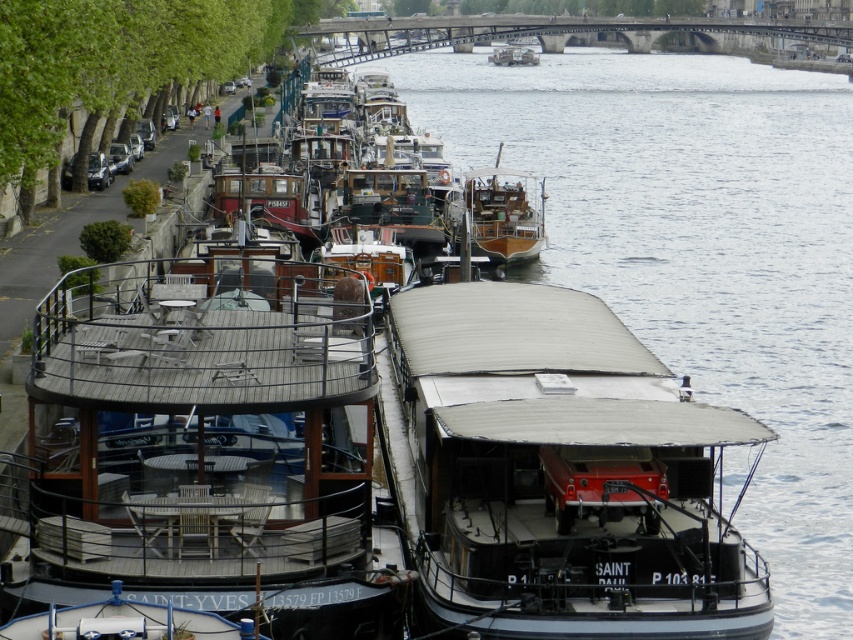
The width and height of the screenshot is (853, 640). I want to click on smooth gray water at center, so click(x=699, y=252).

Where is `smooth gray water at center`? The height and width of the screenshot is (640, 853). smooth gray water at center is located at coordinates (699, 252).

Between smooth gray water at center and black matte boat at center, which one has more height?

smooth gray water at center

Between point (819, 109) and point (463, 460), which one is positioned behind?

The point (819, 109) is behind.

Identify the location of smooth gray water at center. (699, 252).

Is wooden deck boat at center smaller than black matte boat at center?

No, wooden deck boat at center is not smaller than black matte boat at center.

Does wooden deck boat at center appear over black matte boat at center?

Yes, wooden deck boat at center is above black matte boat at center.

What do you see at coordinates (209, 442) in the screenshot?
I see `wooden deck boat at center` at bounding box center [209, 442].

Locate an element on the screen. The width and height of the screenshot is (853, 640). wooden deck boat at center is located at coordinates (209, 442).